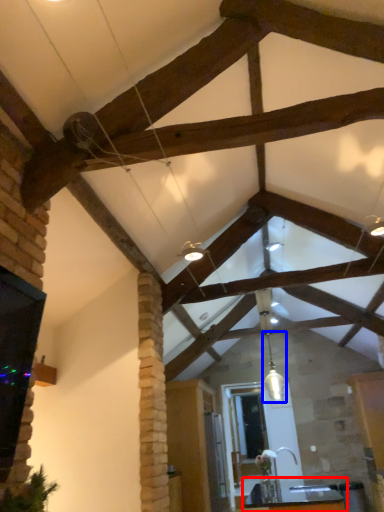
Question: Which object appears closest to the camera in this image, table (highlighted by a red box) or light fixture (highlighted by a blue box)?

Choices:
 (A) table
 (B) light fixture

Answer: (A)